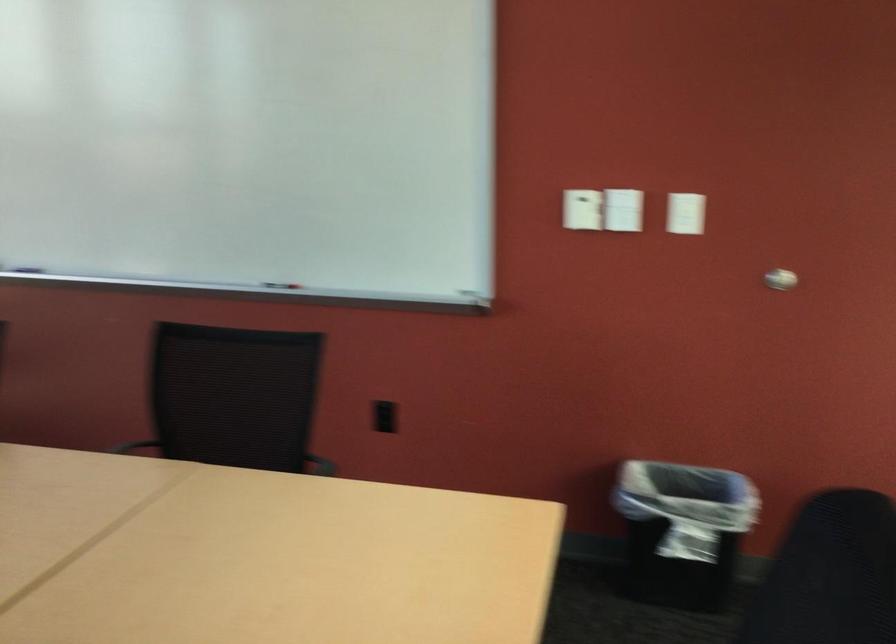
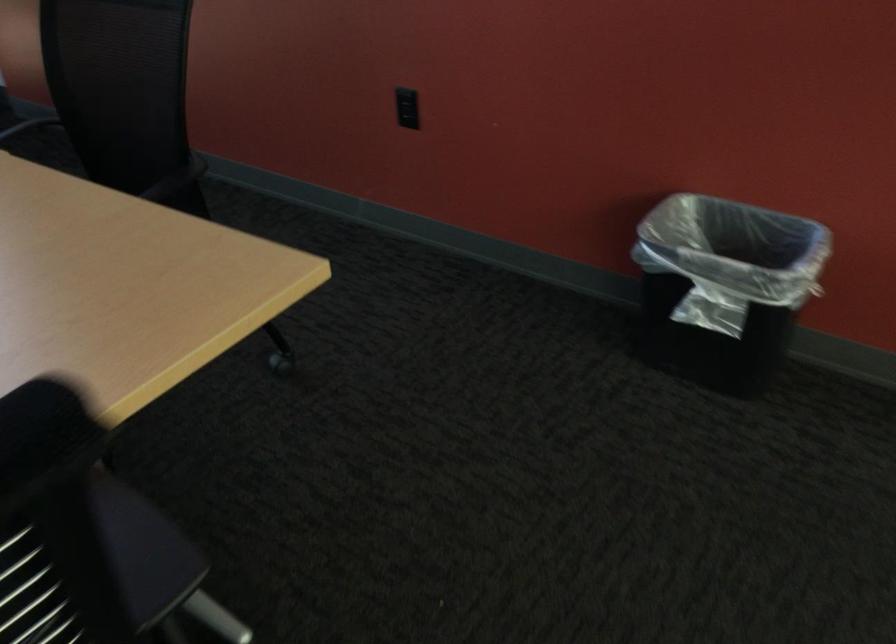
The point at (716,521) is marked in the first image. Where is the corresponding point in the second image?

(725, 287)